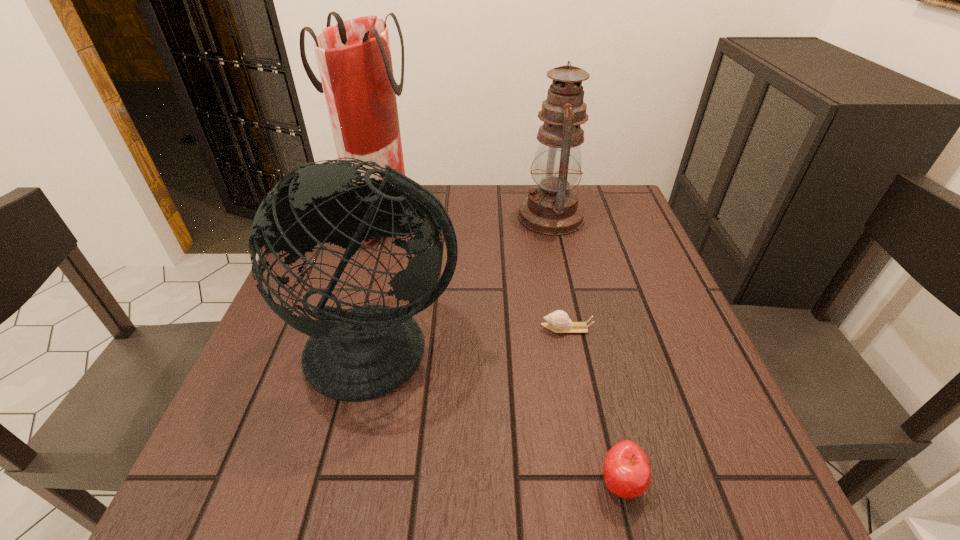
Locate an element on the screen. free spot between the escargot and the globe is located at coordinates (473, 340).

This screenshot has width=960, height=540. I want to click on free space between the tallest object and the shortest object, so click(474, 272).

The width and height of the screenshot is (960, 540). In order to click on vacant space that is in between the oil lamp and the grocery bag in this screenshot , I will do `click(467, 215)`.

You are a GUI agent. You are given a task and a screenshot of the screen. Output one action in this format:
    pyautogui.click(x=<x>, y=<y>)
    Task: Click on the vacant area that lies between the apple and the oil lamp
    Image resolution: width=960 pixels, height=540 pixels.
    Given the screenshot: What is the action you would take?
    pyautogui.click(x=586, y=350)

What are the coordinates of `blank region between the nearest object and the tallest object` in the screenshot? It's located at (501, 349).

The height and width of the screenshot is (540, 960). Identify the location of vacant area that lies between the oil lamp and the fourth tallest object. (586, 350).

This screenshot has height=540, width=960. What are the coordinates of `free space between the second shortest object and the globe` in the screenshot? It's located at (500, 416).

Locate an element on the screen. The height and width of the screenshot is (540, 960). object that is the fourth closest to the tallest object is located at coordinates coord(626,470).

Where is `object that is the fourth closest to the oil lamp`? object that is the fourth closest to the oil lamp is located at coordinates (626, 470).

I want to click on blank area in the image that satisfies the following two spatial constraints: 1. on the shell of the shortest object; 2. on the front-facing side of the globe, so click(x=570, y=350).